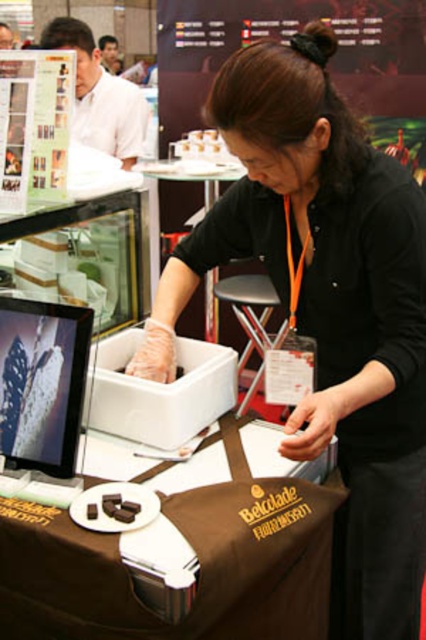
Please describe the position of the brown fabric table at center in terms of its coordinates within the image frame. The image frame is a coordinate system where the bottom left corner is the origin point at coordinates 0,0 and the top right corner is the maximum point at coordinates 1,1. The coordinates are normalized such that all values are between 0 and 1. The question must include the object label exactly as provided in the Objects section. The answer must reference the coordinates provided in the 2D 2

The brown fabric table at center is located at coordinates approximately 0.873 on the x axis and 0.467 on the y axis within the image frame.

You are a photographer at the event and need to take a photo of the brown fabric table at center without including the black matte shirt at center. Based on their positions, which side of the table should you stand to avoid capturing the shirt?

To avoid including the black matte shirt at center in the photo, you should stand to the left side of the brown fabric table at center since the shirt is positioned to the right of the table.